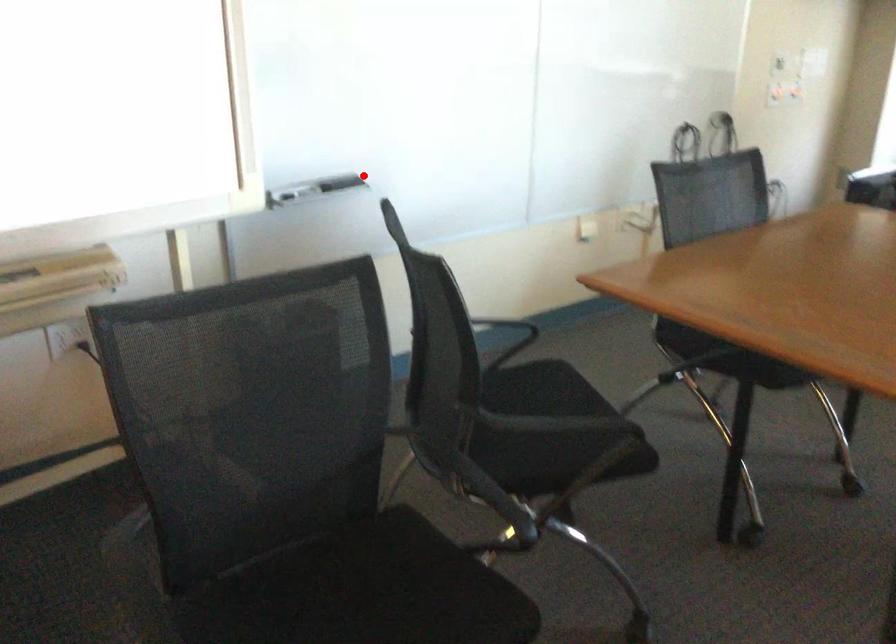
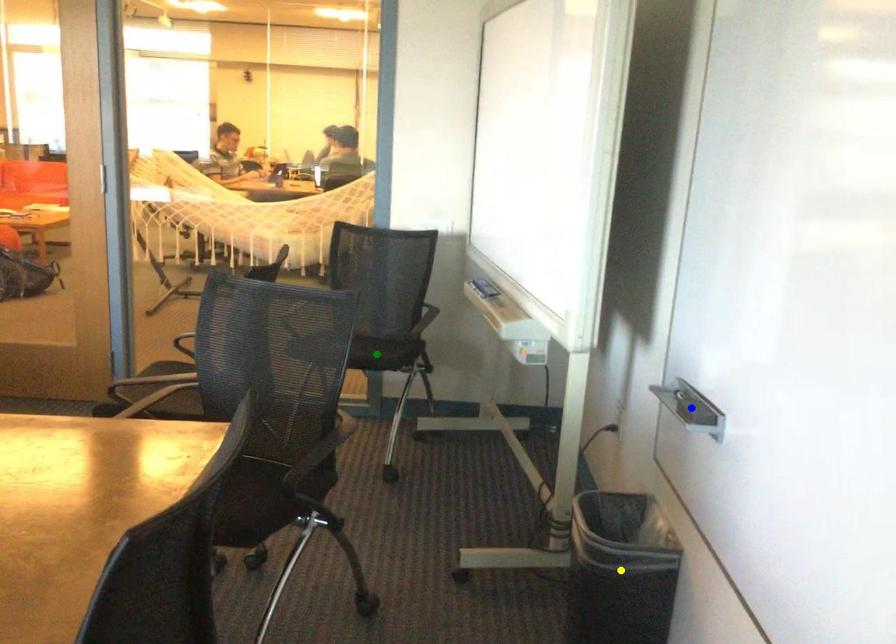
Question: I am providing you with two images of the same scene from different viewpoints. A red point is marked on the first image. You are given multiple points on the second image. Which spot in image 2 lines up with the point in image 1?

Choices:
 (A) yellow point
 (B) green point
 (C) blue point

Answer: (C)